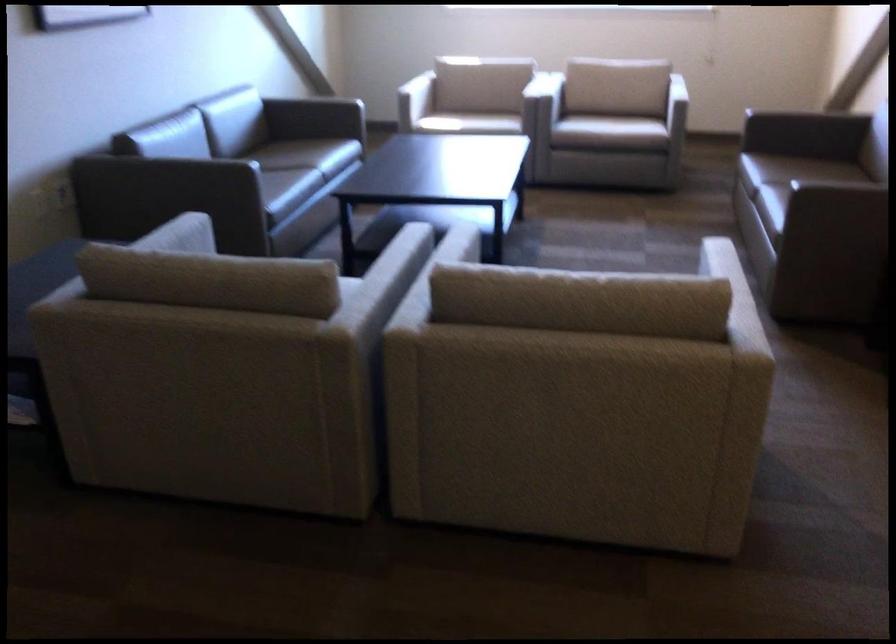
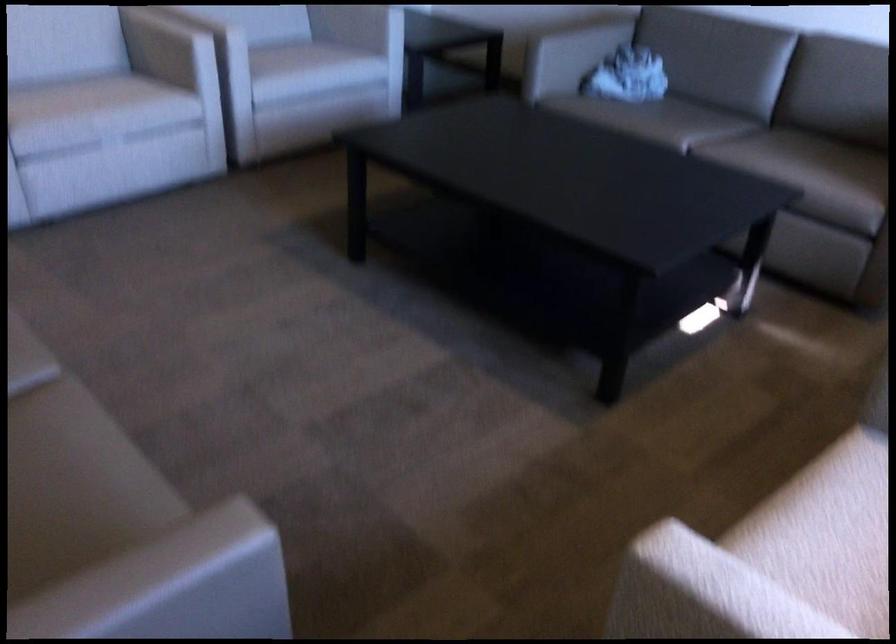
In the second image, find the point that corresponds to point 584,120 in the first image.

(830, 509)